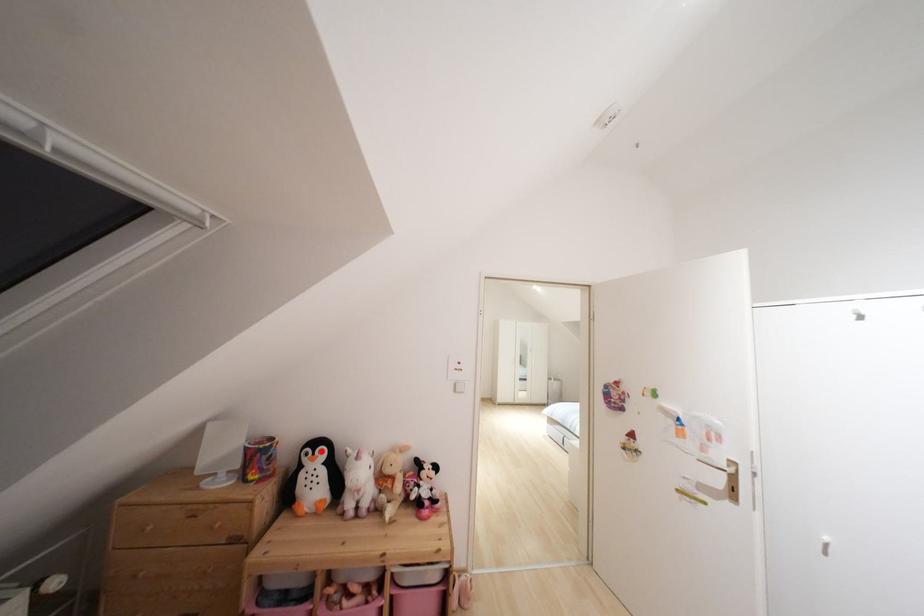
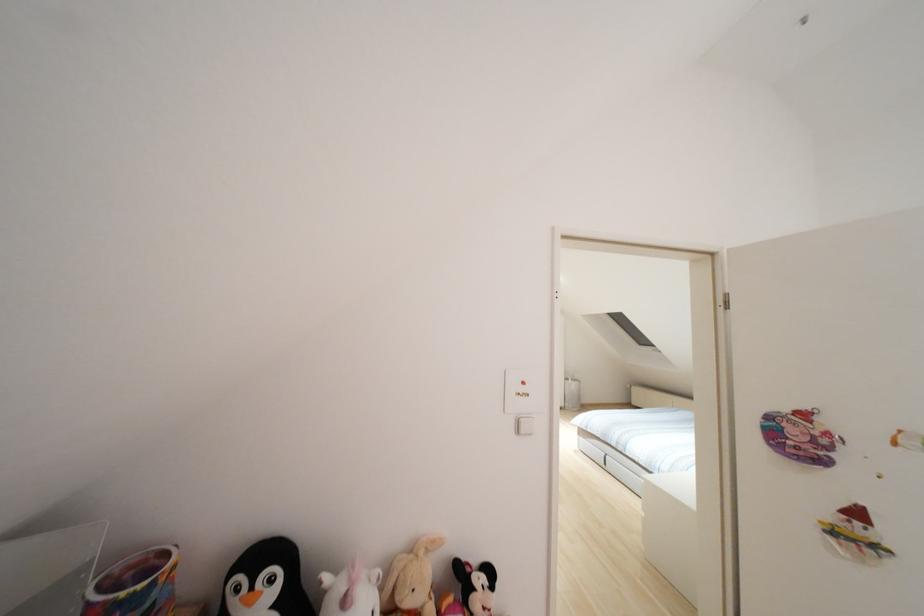
Locate, in the second image, the point that corresponds to the highlighted location in the first image.

(272, 578)